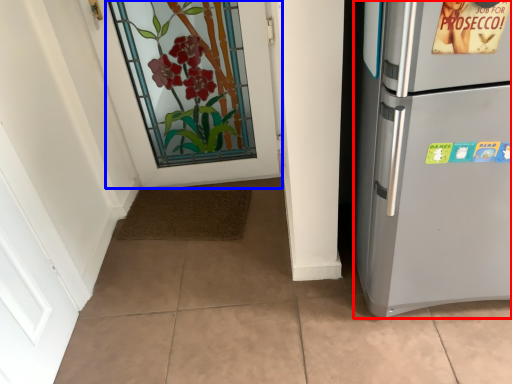
Question: Which object appears closest to the camera in this image, refrigerator (highlighted by a red box) or door (highlighted by a blue box)?

Choices:
 (A) refrigerator
 (B) door

Answer: (A)